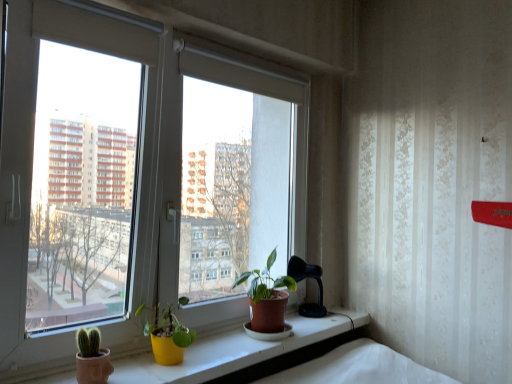
Locate an element on the screen. This screenshot has height=384, width=512. vacant area on the back side of yellow matte pot at lower center, the second houseplant in the right-to-left sequence is located at coordinates (201, 346).